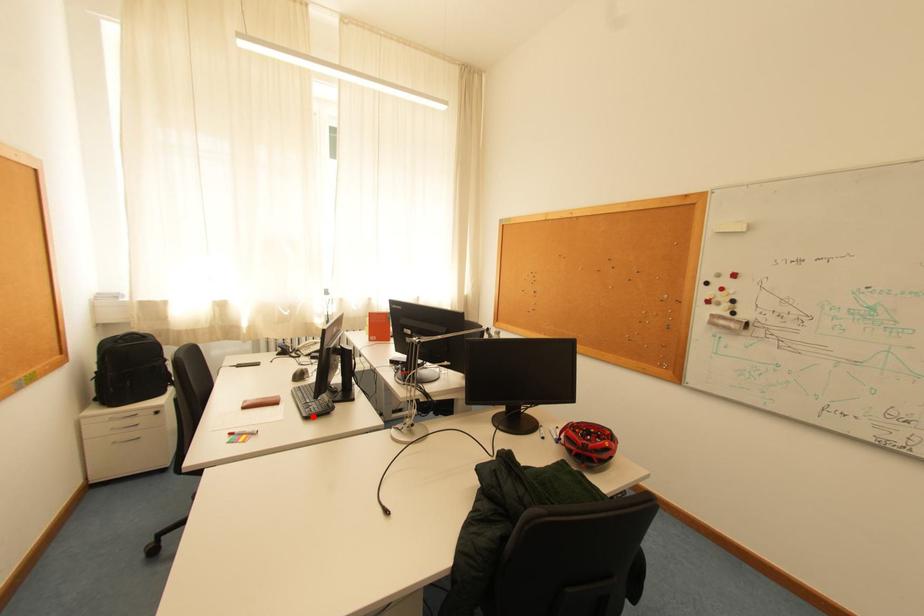
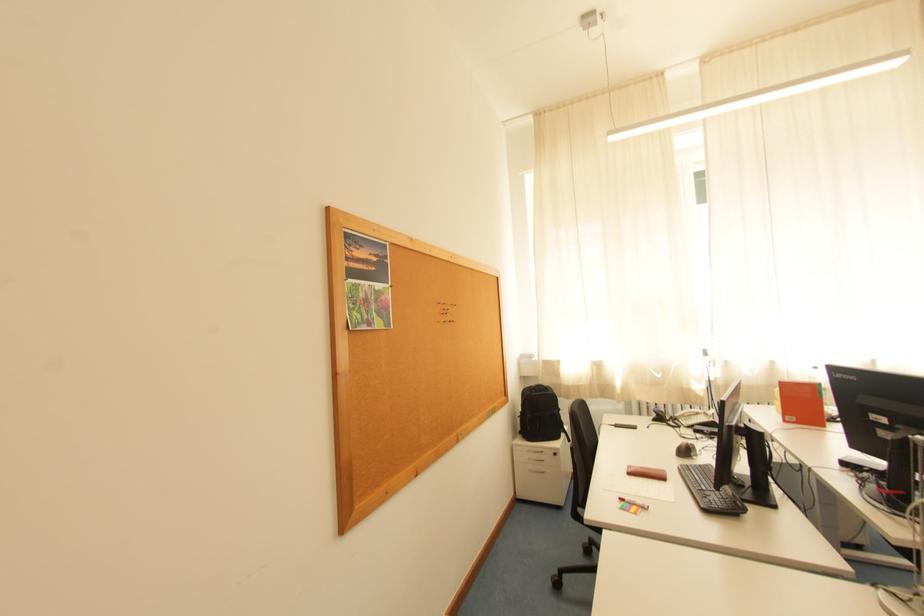
Locate, in the second image, the point that corresponds to the highlighted location in the first image.

(711, 508)